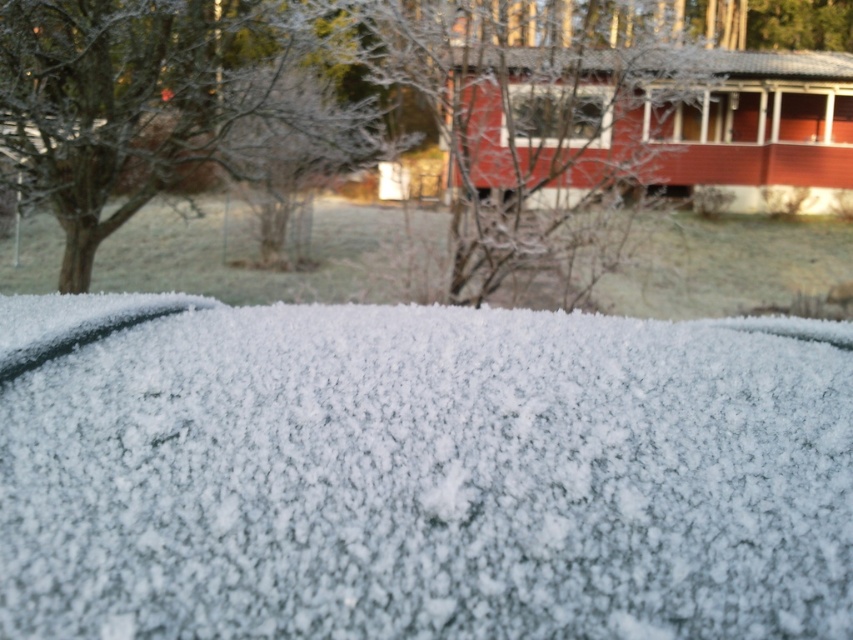
Based on the photo, you are standing in the winter scene and want to place a small decoration exactly at the point marked as point (x=640, y=625). If you are currently 5 feet away from the textured surface covered in frost or snow, can you reach the point without moving closer?

The distance of point (x=640, y=625) from viewer is 3.50 feet. Since you are currently 5 feet away from the textured surface covered in frost or snow, you are farther away than the required distance. Therefore, you need to move closer to reach the point.

From the picture: You are standing outside and looking at the white crystalline frost at center and the transparent glass window at center. Which object is wider?

The white crystalline frost at center is wider than the transparent glass window at center.